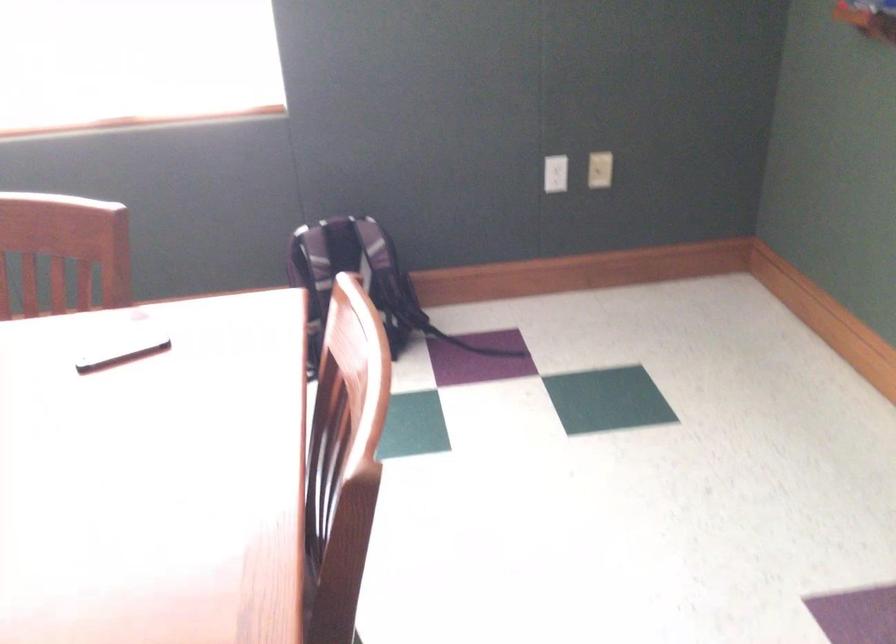
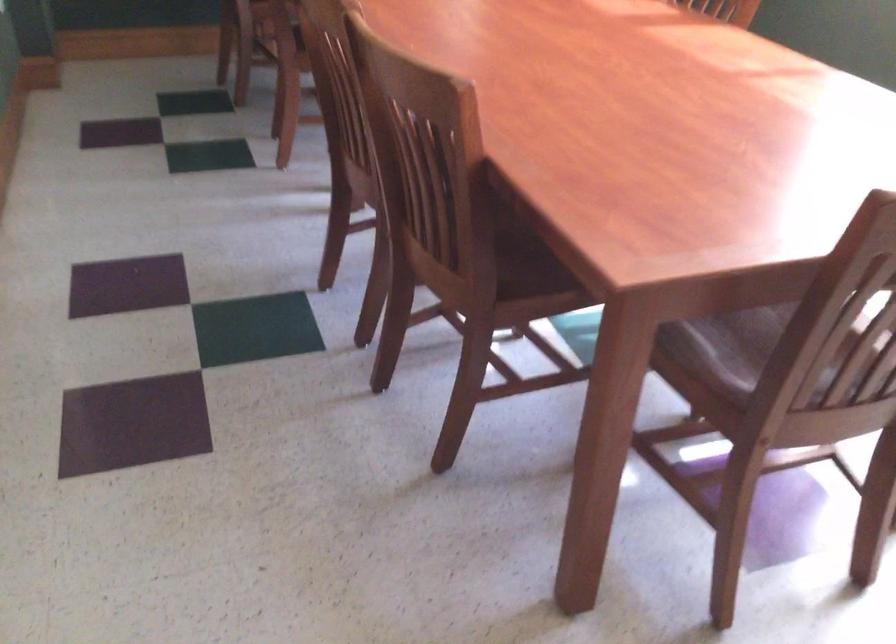
First-person continuous shooting, in which direction is the camera rotating?

The rotation direction of the camera is left-down.